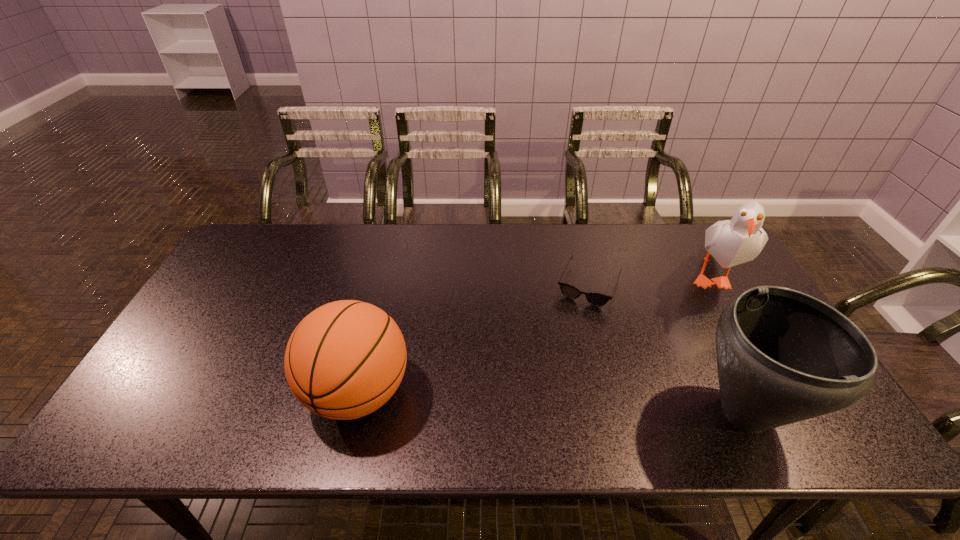
This screenshot has height=540, width=960. Identify the location of the leftmost object. (346, 359).

In order to click on urn in this screenshot , I will do `click(783, 356)`.

At what (x,y) coordinates should I click in order to perform the action: click on the shortest object. Please return your answer as a coordinate pair (x, y). Looking at the image, I should click on (596, 299).

What are the coordinates of `sunglasses` in the screenshot? It's located at (596, 299).

Where is `gull`? gull is located at coordinates (732, 242).

This screenshot has height=540, width=960. Find the location of `vacant space situated on the right of the leftmost object`. vacant space situated on the right of the leftmost object is located at coordinates (561, 392).

At what (x,y) coordinates should I click in order to perform the action: click on free location located on the back of the urn. Please return your answer as a coordinate pair (x, y). The width and height of the screenshot is (960, 540). Looking at the image, I should click on (671, 262).

This screenshot has width=960, height=540. In order to click on free space located on the front lenses of the shortest object in this screenshot , I will do `click(551, 379)`.

Find the location of a particular element. vacant space located on the front lenses of the shortest object is located at coordinates (551, 379).

This screenshot has width=960, height=540. I want to click on free spot located on the front lenses of the shortest object, so click(x=573, y=324).